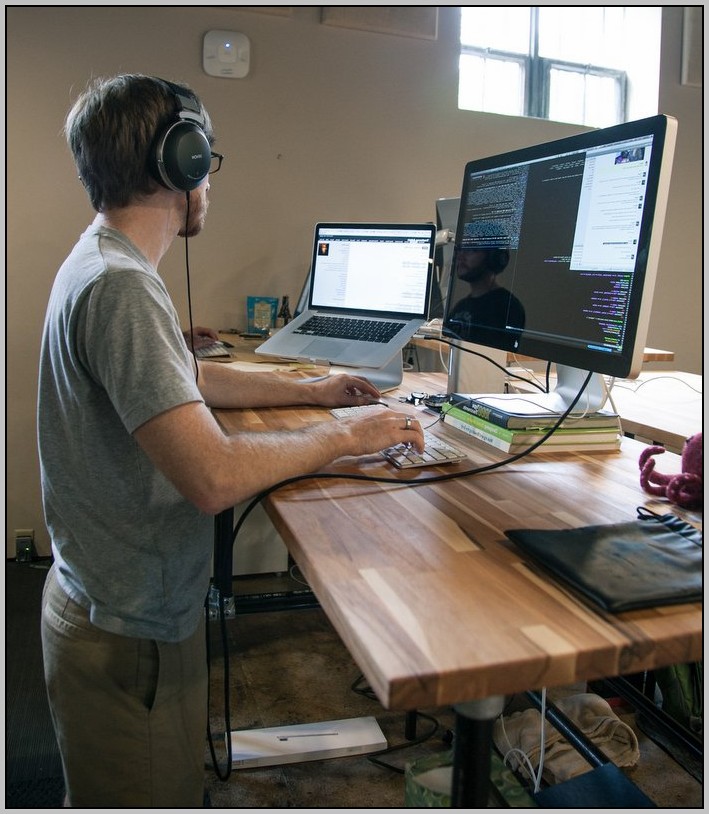
Identify the location of stand-up desk. Image resolution: width=709 pixels, height=814 pixels. (395, 635).